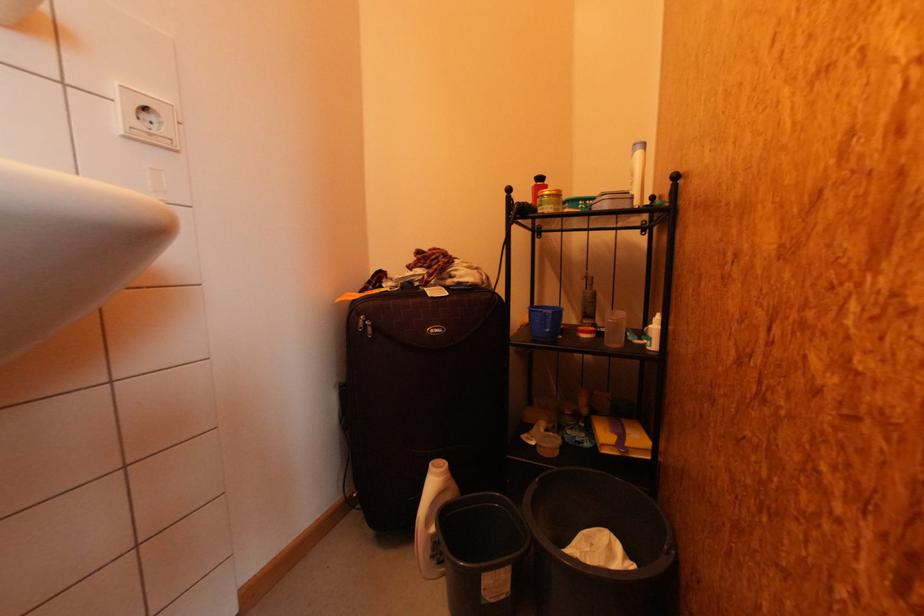
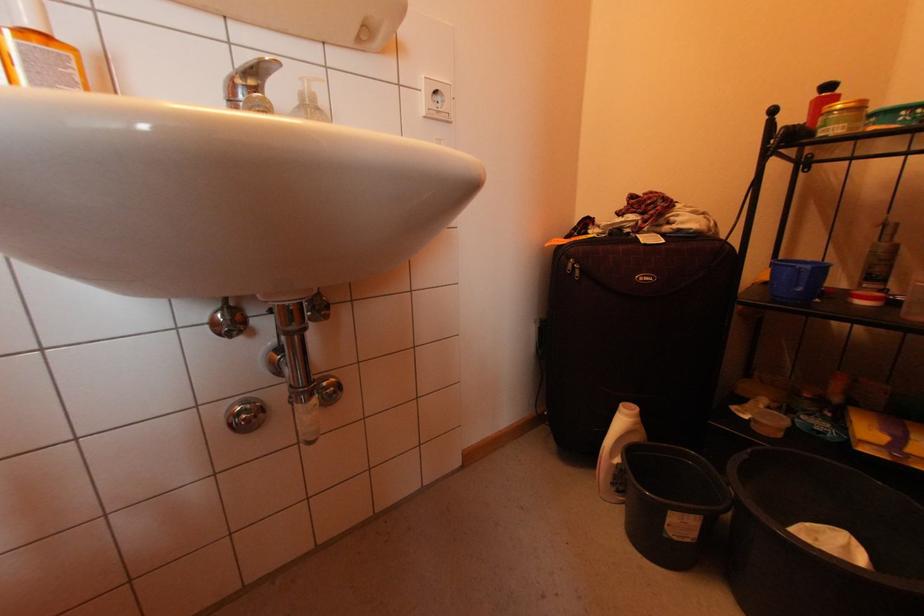
The point at [370,323] is marked in the first image. Where is the corresponding point in the second image?

(578, 265)